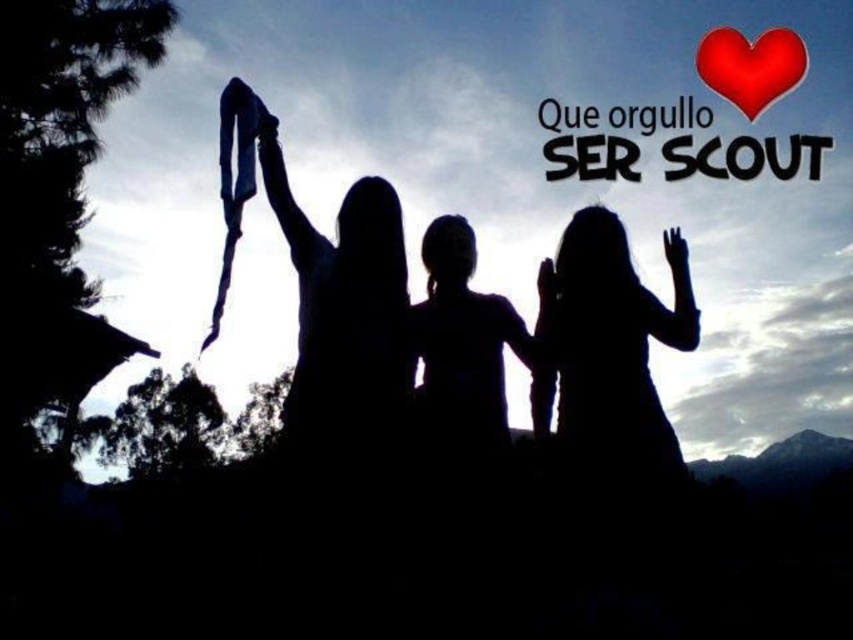
Question: Which is farther from the red matte heart at upper right?

Choices:
 (A) silhouette dress at center
 (B) silhouette hair at center

Answer: (B)

Question: Is the position of silhouette dress at center more distant than that of red matte heart at upper right?

Choices:
 (A) no
 (B) yes

Answer: (A)

Question: Among these points, which one is farthest from the camera?

Choices:
 (A) (618, 218)
 (B) (456, 280)
 (C) (784, 42)

Answer: (C)

Question: Which of the following is the closest to the observer?

Choices:
 (A) (622, 248)
 (B) (502, 444)

Answer: (B)

Question: Can you confirm if silhouette dress at center is thinner than red matte heart at upper right?

Choices:
 (A) no
 (B) yes

Answer: (A)

Question: In this image, where is silhouette dress at center located relative to silhouette hair at center?

Choices:
 (A) left
 (B) right

Answer: (B)